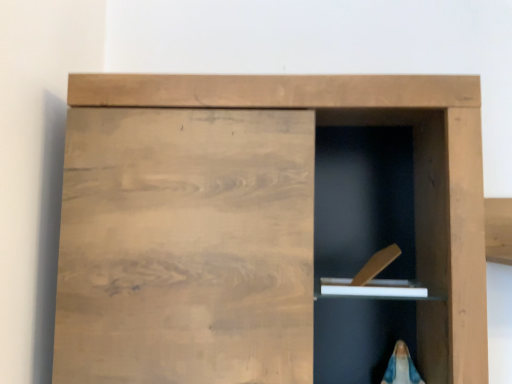
Describe the element at coordinates (249, 191) in the screenshot. I see `natural wood cupboard at center` at that location.

Where is `natural wood cupboard at center`? The height and width of the screenshot is (384, 512). natural wood cupboard at center is located at coordinates (249, 191).

The image size is (512, 384). I want to click on natural wood cupboard at center, so click(x=249, y=191).